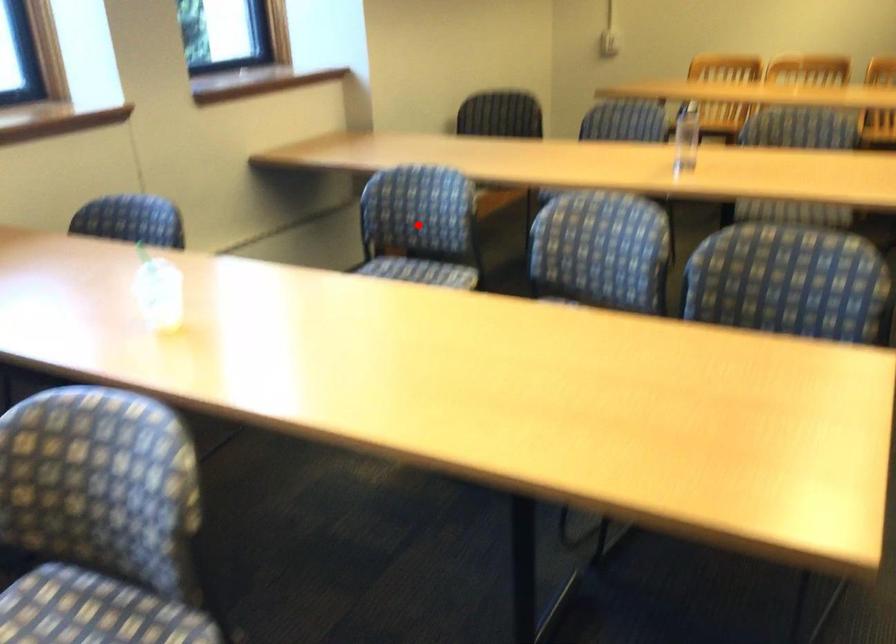
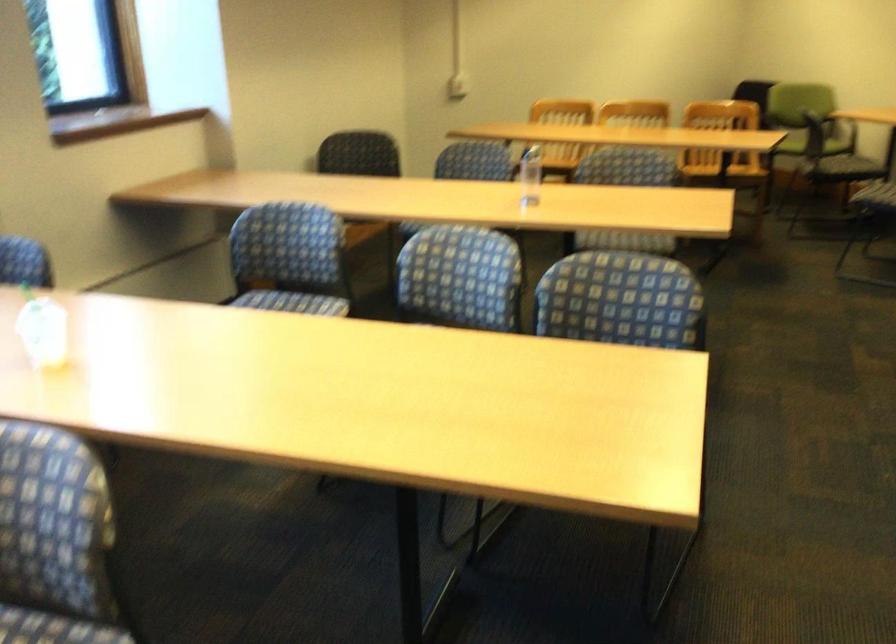
Where in the second image is the point corresponding to the highlighted location from the first image?

(289, 259)